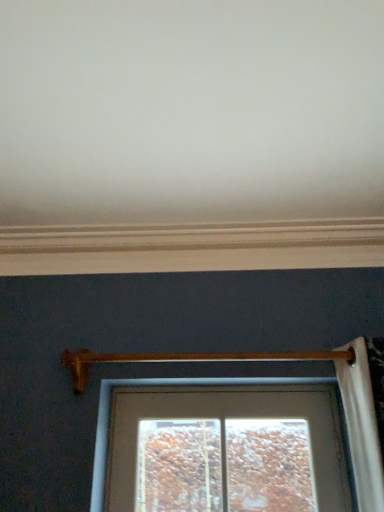
Question: Is white painted wood at upper center positioned with its back to wooden at center?

Choices:
 (A) yes
 (B) no

Answer: (B)

Question: Would you say wooden at center is part of white painted wood at upper center's contents?

Choices:
 (A) no
 (B) yes

Answer: (A)

Question: From a real-world perspective, is white painted wood at upper center on top of wooden at center?

Choices:
 (A) no
 (B) yes

Answer: (B)

Question: From the image's perspective, does white painted wood at upper center appear higher than wooden at center?

Choices:
 (A) yes
 (B) no

Answer: (A)

Question: Would you say white painted wood at upper center is outside wooden at center?

Choices:
 (A) no
 (B) yes

Answer: (B)

Question: Is white painted wood at upper center taller than wooden at center?

Choices:
 (A) no
 (B) yes

Answer: (A)

Question: Considering the relative sizes of wooden at center and white painted wood at upper center in the image provided, is wooden at center smaller than white painted wood at upper center?

Choices:
 (A) no
 (B) yes

Answer: (B)

Question: Considering the relative positions of wooden at center and white painted wood at upper center in the image provided, is wooden at center to the left of white painted wood at upper center from the viewer's perspective?

Choices:
 (A) no
 (B) yes

Answer: (A)

Question: Considering the relative sizes of wooden at center and white painted wood at upper center in the image provided, is wooden at center bigger than white painted wood at upper center?

Choices:
 (A) yes
 (B) no

Answer: (B)

Question: Does wooden at center have a greater width compared to white painted wood at upper center?

Choices:
 (A) yes
 (B) no

Answer: (B)

Question: Does wooden at center lie behind white painted wood at upper center?

Choices:
 (A) no
 (B) yes

Answer: (A)

Question: Is wooden at center oriented towards white painted wood at upper center?

Choices:
 (A) yes
 (B) no

Answer: (B)

Question: From the image's perspective, relative to wooden at center, is white painted wood at upper center above or below?

Choices:
 (A) above
 (B) below

Answer: (A)